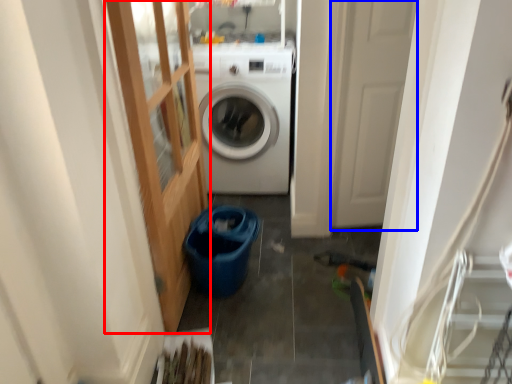
Question: Among these objects, which one is farthest to the camera, glass door (highlighted by a red box) or screen door (highlighted by a blue box)?

Choices:
 (A) glass door
 (B) screen door

Answer: (B)